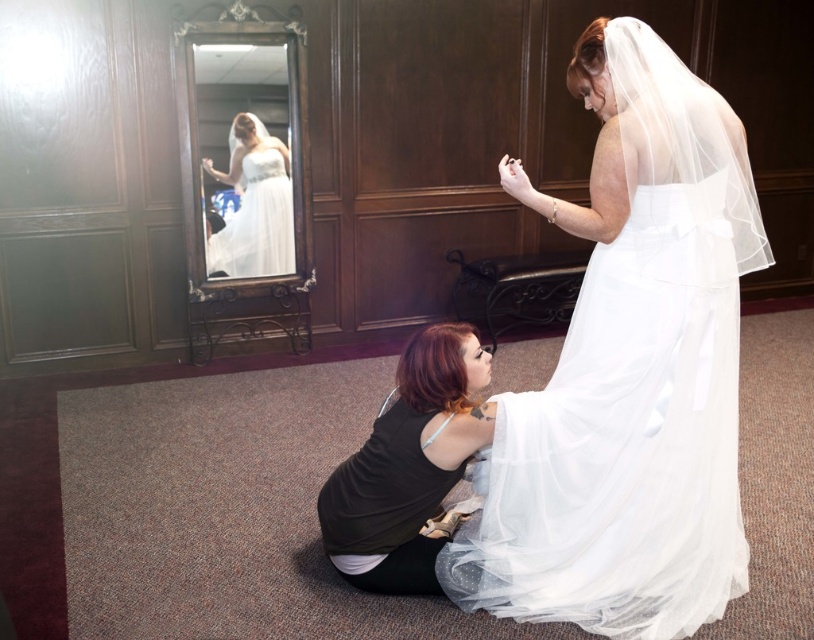
You are standing in the formal room and see the point marked at coordinates (622, 442). What object does this point correspond to?

The point at coordinates (622, 442) corresponds to the white tulle dress at lower center.